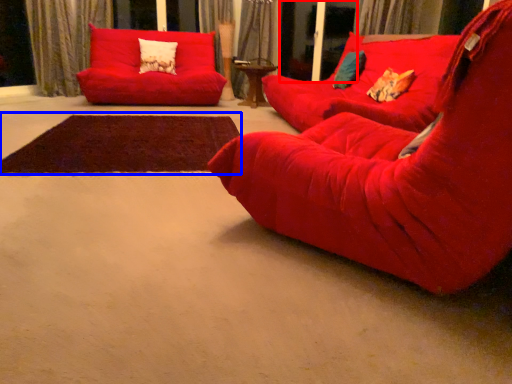
Question: Which point is closer to the camera, screen door (highlighted by a red box) or mat (highlighted by a blue box)?

Choices:
 (A) screen door
 (B) mat

Answer: (B)